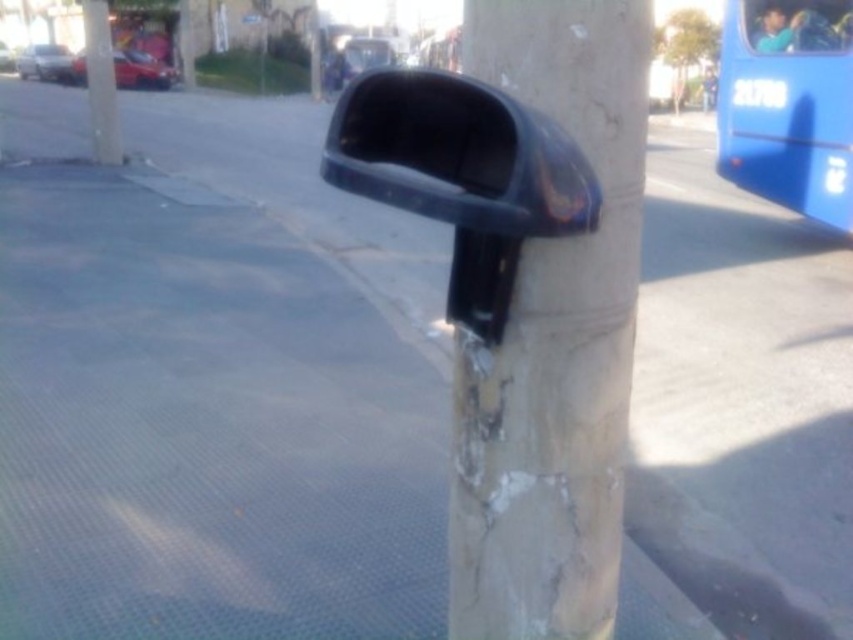
You are a drone operator trying to capture a close up of the point at coordinates (532,189) on the weathered concrete pole. The drone is currently 30 inches away from the pole. Can the drone move closer to get a better shot without hitting the pole?

The point at coordinates (532,189) is 28.83 inches away from the camera. Since the drone is currently 30 inches away from the pole, it can move 1.17 inches closer to get a better shot without hitting the pole.

You are a delivery driver who needs to check the blind spot on the right side of your blue bus. You see a black plastic view mirror at center marked by point (457, 154). Can you use this mirror to check the blind spot?

The black plastic view mirror at center marked by point (457, 154) is positioned at the center of the pole, so it might not provide a clear view of the right side blind spot of your blue bus unless it is angled appropriately. However, since the mirror is at center, it might not be positioned to cover the right side effectively.